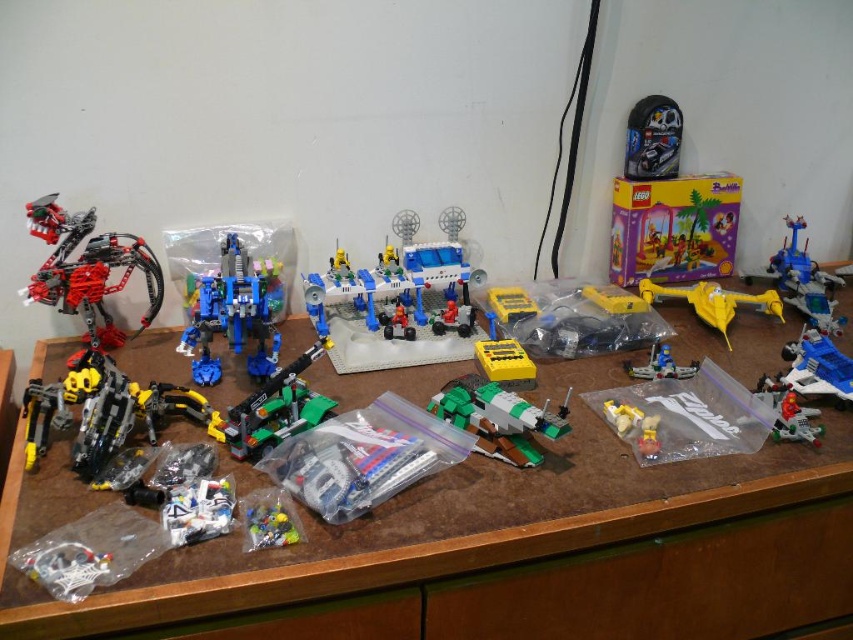
Looking at this image, can you confirm if translucent plastic bag at center is bigger than translucent blue plastic spaceship at center?

Yes, translucent plastic bag at center is bigger than translucent blue plastic spaceship at center.

Which is behind, point (288, 467) or point (631, 365)?

The point (631, 365) is more distant.

Describe the element at coordinates (349, 464) in the screenshot. I see `translucent plastic bag at center` at that location.

Locate an element on the screen. The width and height of the screenshot is (853, 640). translucent plastic bag at center is located at coordinates (349, 464).

Does translucent plastic toy at lower left appear on the left side of translucent plastic toy at lower center?

Indeed, translucent plastic toy at lower left is positioned on the left side of translucent plastic toy at lower center.

Is translucent plastic toy at lower left shorter than translucent plastic toy at lower center?

No.

Is point (77, 563) positioned in front of point (280, 513)?

Yes, it is in front of point (280, 513).

Identify the location of translucent plastic toy at lower left. The height and width of the screenshot is (640, 853). (62, 566).

Does brown wooden table at center have a larger size compared to black matte helmet at upper right?

Correct, brown wooden table at center is larger in size than black matte helmet at upper right.

The height and width of the screenshot is (640, 853). What do you see at coordinates (519, 547) in the screenshot?
I see `brown wooden table at center` at bounding box center [519, 547].

Is point (15, 634) behind point (670, 129)?

No, it is in front of (670, 129).

Find the location of a particular element. The width and height of the screenshot is (853, 640). brown wooden table at center is located at coordinates (519, 547).